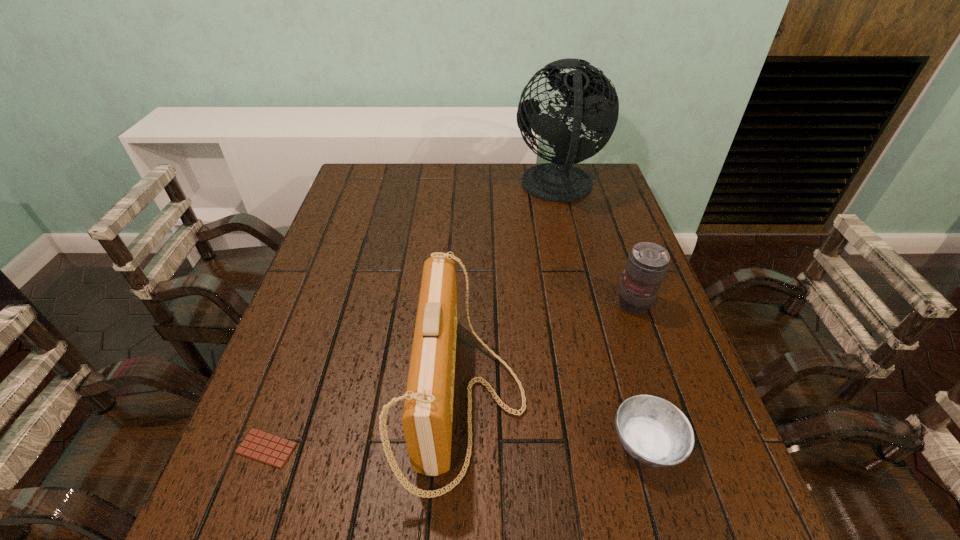
I want to click on the farthest object, so click(595, 103).

At what (x,y) coordinates should I click in order to perform the action: click on globe. Please return your answer as a coordinate pair (x, y). Image resolution: width=960 pixels, height=540 pixels. Looking at the image, I should click on click(x=595, y=103).

This screenshot has width=960, height=540. In order to click on the second object from left to right in this screenshot , I will do click(x=427, y=418).

Locate an element on the screen. the second tallest object is located at coordinates (427, 418).

In order to click on the third tallest object in this screenshot , I will do `click(647, 264)`.

Find the location of `the second farthest object`. the second farthest object is located at coordinates (647, 264).

You are a GUI agent. You are given a task and a screenshot of the screen. Output one action in this format:
    pyautogui.click(x=<x>, y=<y>)
    Task: Click on the ashtray
    
    Given the screenshot: What is the action you would take?
    click(x=652, y=430)

The width and height of the screenshot is (960, 540). Identify the location of the shortest object. (258, 445).

Where is `candy bar`? The image size is (960, 540). candy bar is located at coordinates (258, 445).

Find the location of a particular element. free point located on the front-facing side of the farthest object is located at coordinates 407,188.